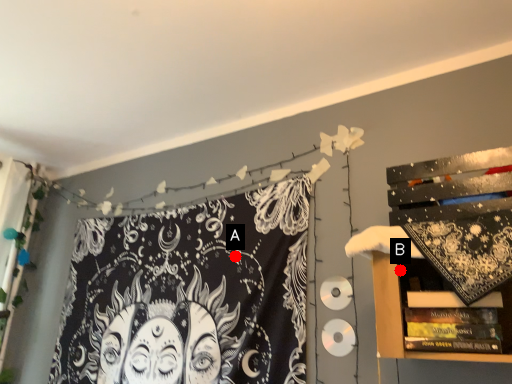
Question: Two points are circled on the image, labeled by A and B beside each circle. Which point appears closest to the camera in this image?

Choices:
 (A) A is closer
 (B) B is closer

Answer: (B)